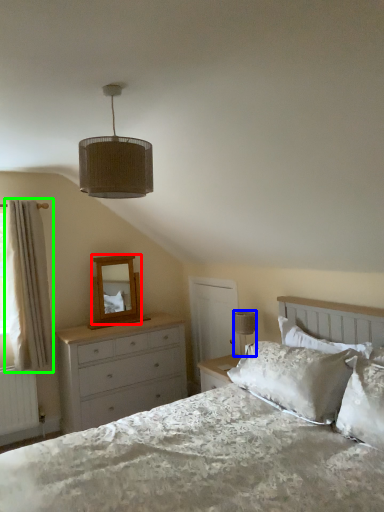
Question: Which object is the farthest from mirror (highlighted by a red box)? Choose among these: table lamp (highlighted by a blue box) or curtain (highlighted by a green box).

Choices:
 (A) table lamp
 (B) curtain

Answer: (A)